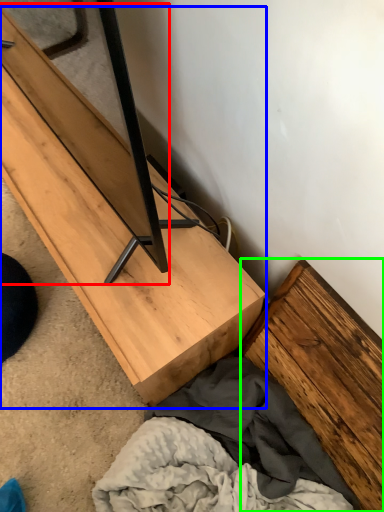
Question: Based on their relative distances, which object is farther from plank (highlighted by a red box)? Choose from furniture (highlighted by a blue box) and plank (highlighted by a green box).

Choices:
 (A) furniture
 (B) plank

Answer: (B)